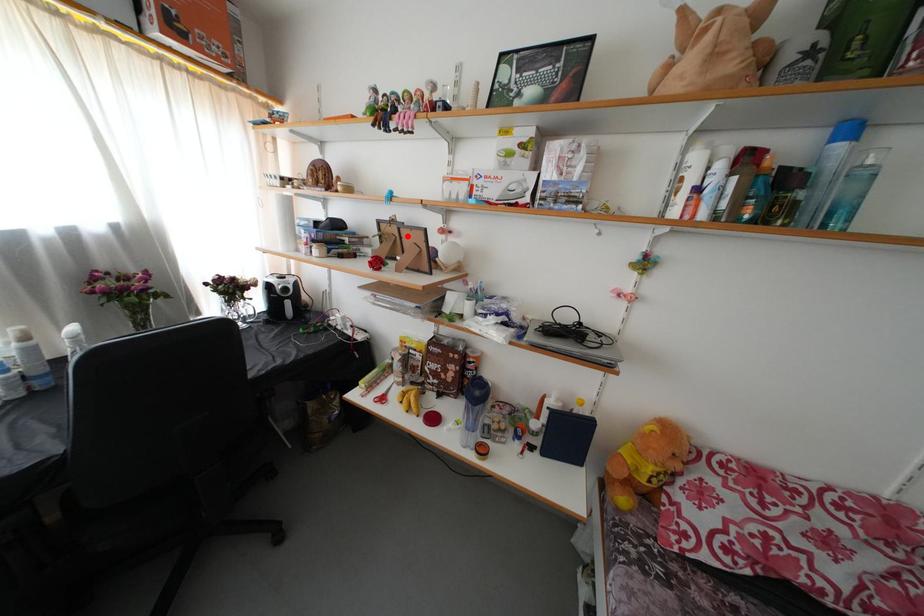
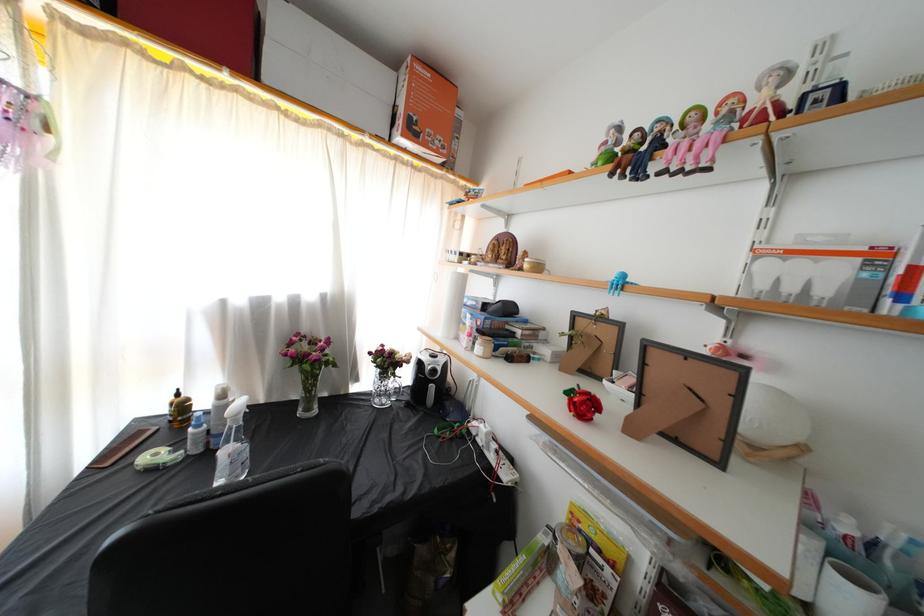
The point at the highlighted location is marked in the first image. Where is the corresponding point in the second image?

(659, 358)